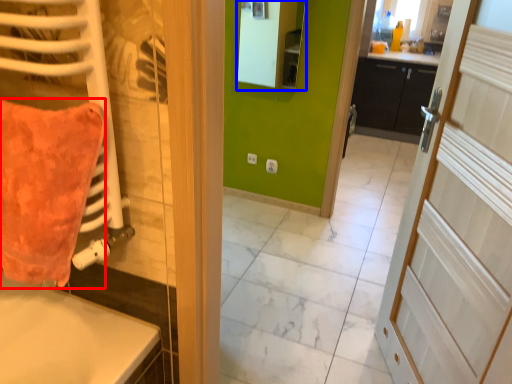
Question: Which object is closer to the camera taking this photo, throw pillow (highlighted by a red box) or mirror (highlighted by a blue box)?

Choices:
 (A) throw pillow
 (B) mirror

Answer: (A)